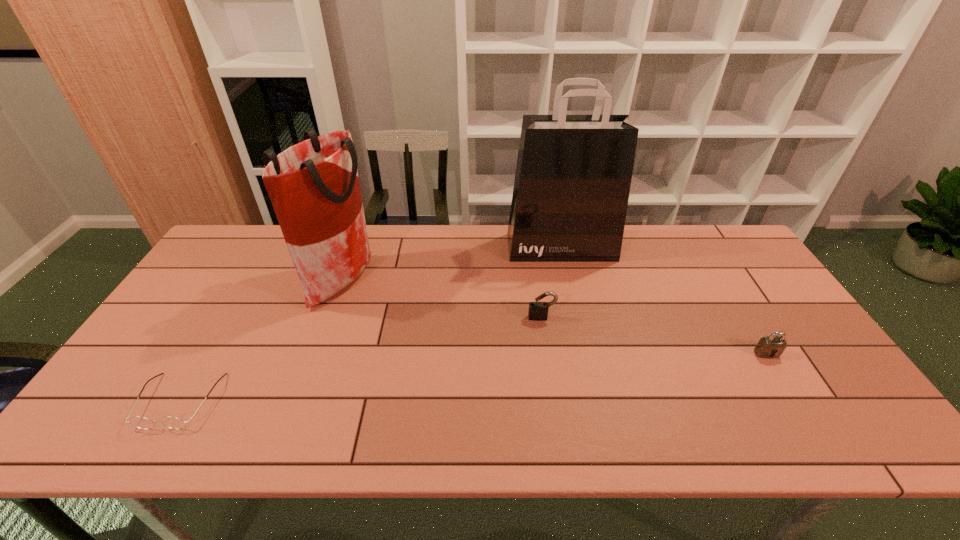
The width and height of the screenshot is (960, 540). What are the coordinates of `vacant space situated on the left of the second object from left to right` in the screenshot? It's located at (205, 280).

Find the location of a particular element. This screenshot has height=540, width=960. free region located 0.120m with the keyhole on the front of the taller padlock is located at coordinates (547, 354).

Locate an element on the screen. blank area located 0.160m at the front of the nearer padlock near the keyhole is located at coordinates click(x=804, y=414).

You are a GUI agent. You are given a task and a screenshot of the screen. Output one action in this format:
    pyautogui.click(x=<x>, y=<y>)
    Task: Click on the shopping bag present at the far edge
    This screenshot has width=960, height=540.
    Given the screenshot: What is the action you would take?
    tap(573, 175)

At what (x,y) coordinates should I click in order to perform the action: click on grocery bag that is at the far edge. Please return your answer as a coordinate pair (x, y). The width and height of the screenshot is (960, 540). Looking at the image, I should click on (314, 187).

This screenshot has width=960, height=540. Identify the location of object that is at the near edge. (171, 422).

I want to click on object that is at the left edge, so click(x=171, y=422).

Locate an element on the screen. This screenshot has width=960, height=540. object positioned at the right edge is located at coordinates (772, 346).

The image size is (960, 540). Find the location of `object at the near left corner`. object at the near left corner is located at coordinates (171, 422).

Identify the location of free space at the far edge of the desktop. (483, 249).